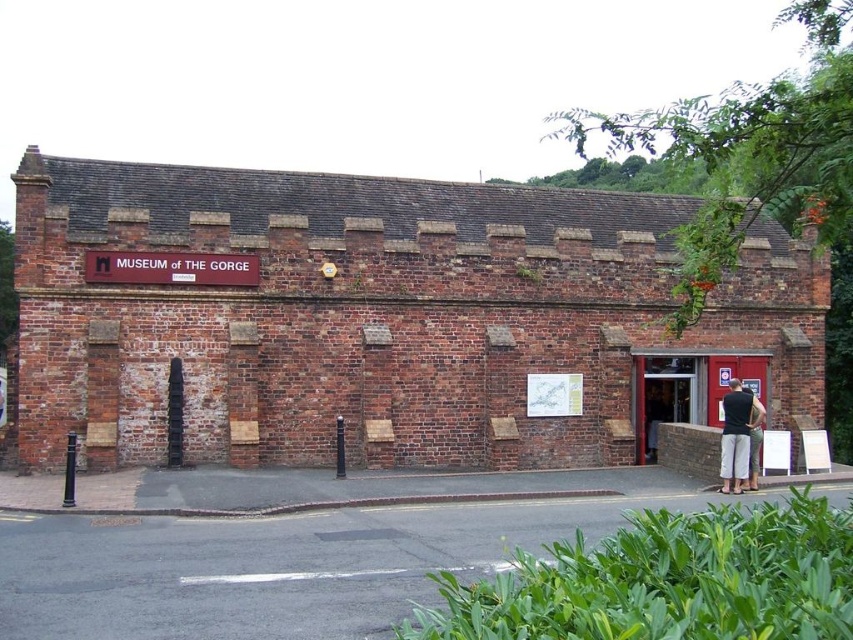
You are a fashion designer observing two pairs of pants displayed in the museum entrance. The light gray pants at center and the dark gray fabric pants at lower right. Which pair is bigger in size?

The light gray pants at center has a larger size compared to the dark gray fabric pants at lower right.

You are a visitor standing in front of the museum entrance. You notice two pairs of pants displayed on mannequins near the entrance. The light gray pants at center and dark gray fabric pants at lower right. Which pair of pants is wider?

The light gray pants at center is wider than the dark gray fabric pants at lower right.